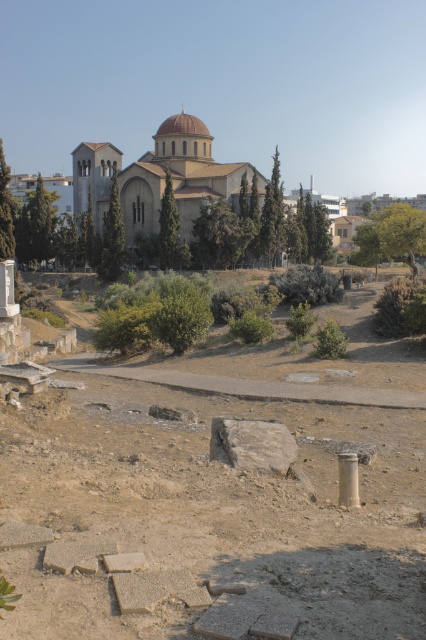
Is brown stone ruins at center to the right of beige stone church at center from the viewer's perspective?

Correct, you'll find brown stone ruins at center to the right of beige stone church at center.

Is point (28, 637) positioned in front of point (219, 163)?

Yes, point (28, 637) is in front of point (219, 163).

This screenshot has height=640, width=426. Describe the element at coordinates (209, 509) in the screenshot. I see `brown stone ruins at center` at that location.

I want to click on brown stone ruins at center, so click(x=209, y=509).

In the scene shown: Is brown stone ruins at center smaller than silver metallic pillar at lower right?

No, brown stone ruins at center is not smaller than silver metallic pillar at lower right.

Measure the distance between point (152, 422) and camera.

A distance of 43.16 feet exists between point (152, 422) and camera.

Locate an element on the screen. Image resolution: width=426 pixels, height=640 pixels. brown stone ruins at center is located at coordinates (209, 509).

Is point (134, 188) positioned after point (342, 470)?

Yes, point (134, 188) is farther from viewer.

Is beige stone church at center thinner than silver metallic pillar at lower right?

No, beige stone church at center is not thinner than silver metallic pillar at lower right.

Where is `beige stone church at center`? The image size is (426, 640). beige stone church at center is located at coordinates (161, 177).